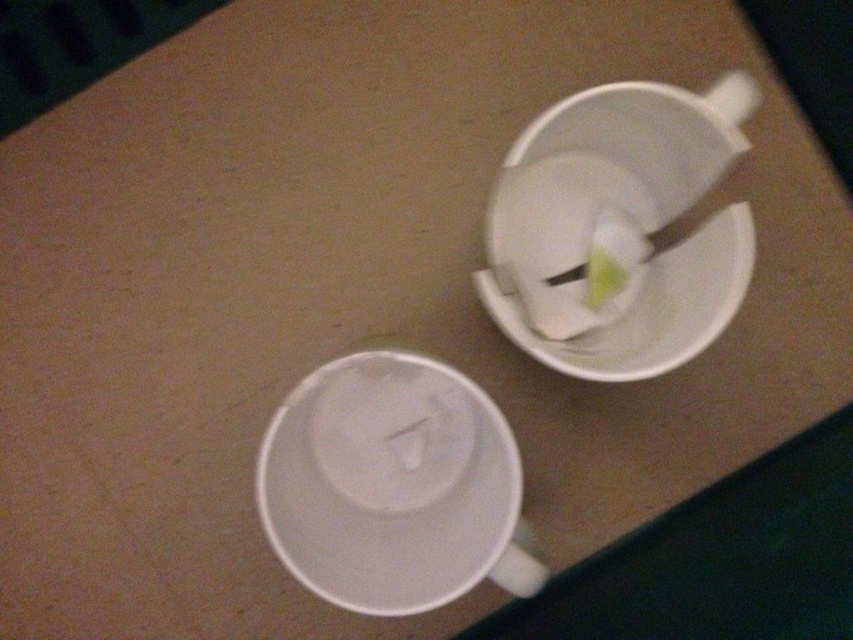
You are placing a cookie on the table and want to choose the saucer that can fit it better. Which saucer should you choose between the white matte saucer at lower left and the white matte saucer at upper right?

The white matte saucer at lower left might be wider than the white matte saucer at upper right, so it can fit the cookie better.

You are setting up a tea service and need to place both the white matte saucer at center and the white matte saucer at upper right on a table. Which saucer should you choose if you want to use the one that takes up more space?

The white matte saucer at upper right should be chosen because it occupies more space than the white matte saucer at center.

You are a barista preparing a drink and need to place a saucer under a cup. Given the coordinates of the white matte saucer at lower left as point (392,486), where should you position the cup relative to this point to ensure it is centered?

To center the cup on the white matte saucer at lower left, position the cup so its center aligns with the point (392,486).